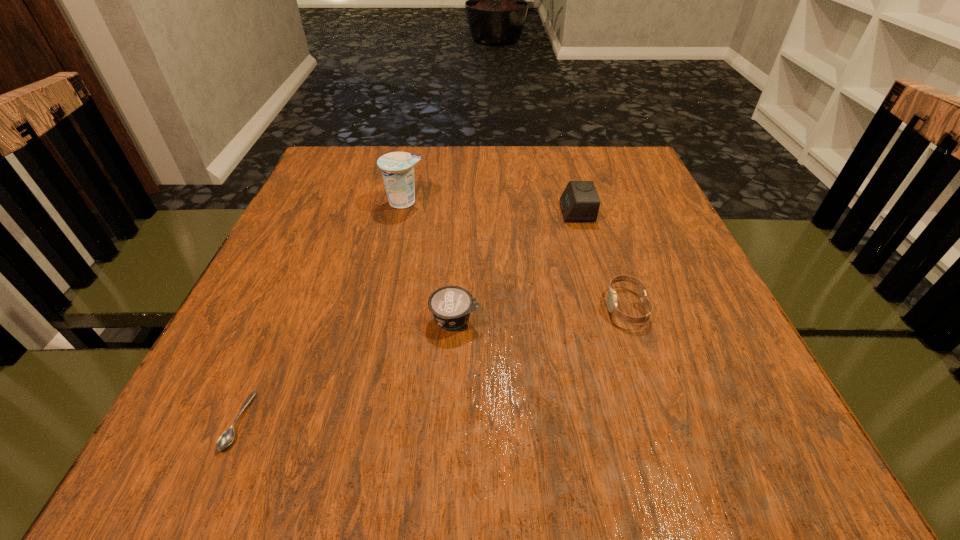
Find the location of `object located in the right edge section of the desktop`. object located in the right edge section of the desktop is located at coordinates (611, 296).

Find the location of `object present at the near left corner`. object present at the near left corner is located at coordinates (227, 437).

I want to click on vacant space at the far edge of the desktop, so click(x=487, y=164).

Locate an element on the screen. blank area at the left edge is located at coordinates (320, 193).

The image size is (960, 540). I want to click on free space at the right edge of the desktop, so click(630, 195).

Identify the location of free space at the far right corner. (x=618, y=188).

Find the location of a particular element. This screenshot has height=540, width=960. free space between the alarm clock and the fourth object from right to left is located at coordinates (491, 207).

I want to click on unoccupied area between the shortest object and the alarm clock, so click(x=407, y=316).

In order to click on vacant area that lies between the farther yogurt and the nearer yogurt in this screenshot , I will do `click(430, 260)`.

At what (x,y) coordinates should I click in order to perform the action: click on free spot between the shorter yogurt and the watch. Please return your answer as a coordinate pair (x, y). Looking at the image, I should click on (540, 313).